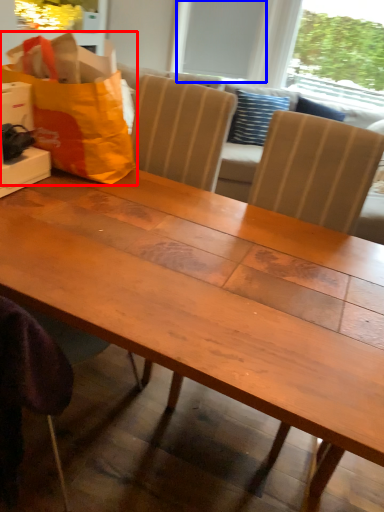
Question: Which object is further to the camera taking this photo, grocery bag (highlighted by a red box) or window screen (highlighted by a blue box)?

Choices:
 (A) grocery bag
 (B) window screen

Answer: (B)